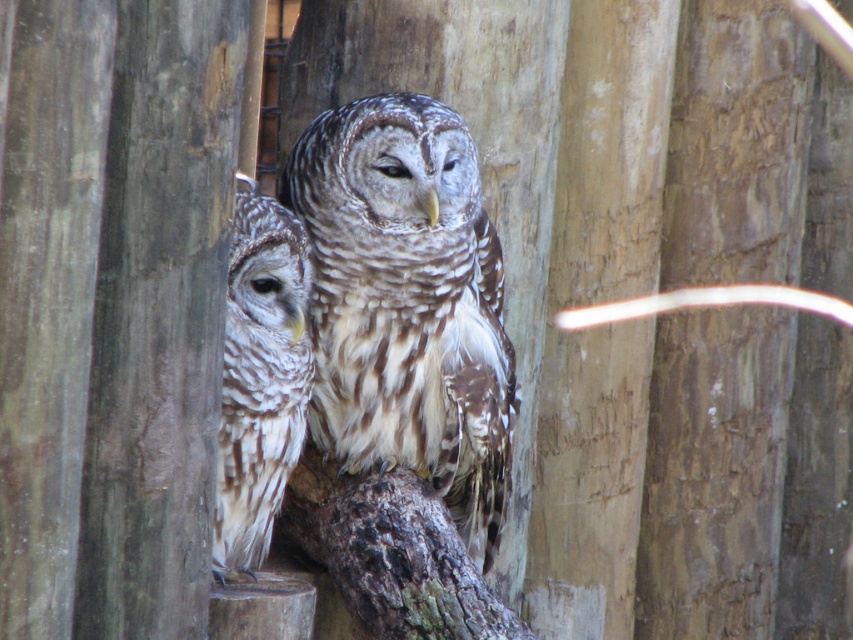
Question: Can you confirm if speckled feathered owl at center is bigger than speckled feathered owl at left?

Choices:
 (A) yes
 (B) no

Answer: (A)

Question: Does speckled feathered owl at center appear under speckled feathered owl at left?

Choices:
 (A) no
 (B) yes

Answer: (A)

Question: Is speckled feathered owl at center positioned behind speckled feathered owl at left?

Choices:
 (A) yes
 (B) no

Answer: (A)

Question: Which object is closer to the camera taking this photo?

Choices:
 (A) speckled feathered owl at center
 (B) speckled feathered owl at left

Answer: (B)

Question: Among these objects, which one is nearest to the camera?

Choices:
 (A) speckled feathered owl at center
 (B) speckled feathered owl at left

Answer: (B)